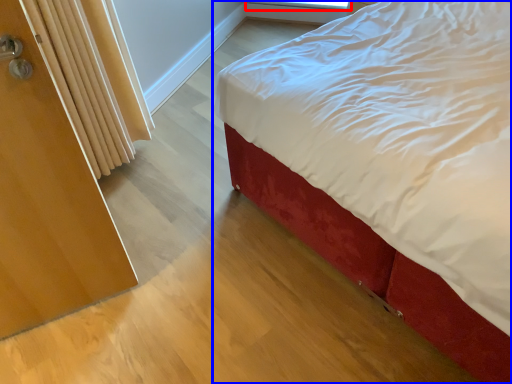
Question: Which of the following is the closest to the observer, window screen (highlighted by a red box) or bed (highlighted by a blue box)?

Choices:
 (A) window screen
 (B) bed

Answer: (B)